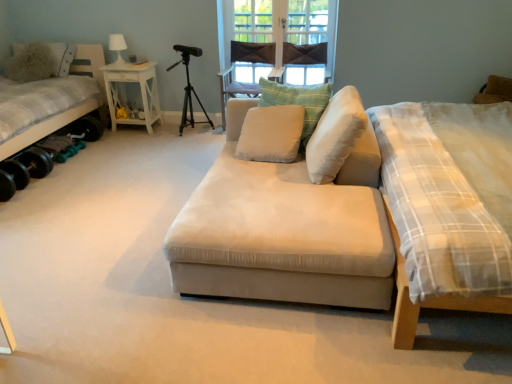
Question: Considering the relative sizes of dark fabric window screen at center and white soft cushion at center, marked as the third pillow in a back-to-front arrangement, in the image provided, is dark fabric window screen at center wider than white soft cushion at center, marked as the third pillow in a back-to-front arrangement,?

Choices:
 (A) yes
 (B) no

Answer: (B)

Question: Is there a large distance between dark fabric window screen at center and white soft cushion at center, marked as the third pillow in a right-to-left arrangement?

Choices:
 (A) yes
 (B) no

Answer: (A)

Question: Is dark fabric window screen at center positioned before white soft cushion at center, arranged as the 2th pillow when viewed from the front?

Choices:
 (A) yes
 (B) no

Answer: (B)

Question: Is dark fabric window screen at center smaller than white soft cushion at center, arranged as the 2th pillow when viewed from the front?

Choices:
 (A) no
 (B) yes

Answer: (B)

Question: Does dark fabric window screen at center have a greater height compared to white soft cushion at center, marked as the 2th pillow in a left-to-right arrangement?

Choices:
 (A) no
 (B) yes

Answer: (B)

Question: From a real-world perspective, is dark fabric window screen at center beneath white soft cushion at center, marked as the third pillow in a right-to-left arrangement?

Choices:
 (A) yes
 (B) no

Answer: (B)

Question: From a real-world perspective, is white soft cushion at center, marked as the third pillow in a right-to-left arrangement, below fuzzy fabric pillow at upper left, placed as the first pillow when sorted from back to front?

Choices:
 (A) yes
 (B) no

Answer: (A)

Question: Can we say white soft cushion at center, marked as the 2th pillow in a left-to-right arrangement, lies outside fuzzy fabric pillow at upper left, placed as the first pillow when sorted from back to front?

Choices:
 (A) yes
 (B) no

Answer: (A)

Question: From the image's perspective, is white soft cushion at center, arranged as the 2th pillow when viewed from the front, located beneath fuzzy fabric pillow at upper left, marked as the 1th pillow in a left-to-right arrangement?

Choices:
 (A) no
 (B) yes

Answer: (B)

Question: Can you confirm if white soft cushion at center, marked as the third pillow in a right-to-left arrangement, is taller than fuzzy fabric pillow at upper left, placed as the fourth pillow when sorted from front to back?

Choices:
 (A) no
 (B) yes

Answer: (A)

Question: Is fuzzy fabric pillow at upper left, marked as the 1th pillow in a left-to-right arrangement, inside white soft cushion at center, arranged as the 2th pillow when viewed from the front?

Choices:
 (A) no
 (B) yes

Answer: (A)

Question: Are white soft cushion at center, marked as the 2th pillow in a left-to-right arrangement, and fuzzy fabric pillow at upper left, placed as the first pillow when sorted from back to front, located far from each other?

Choices:
 (A) no
 (B) yes

Answer: (B)

Question: Can you confirm if white wood side table at left is wider than plaid fabric mattress at right?

Choices:
 (A) no
 (B) yes

Answer: (A)